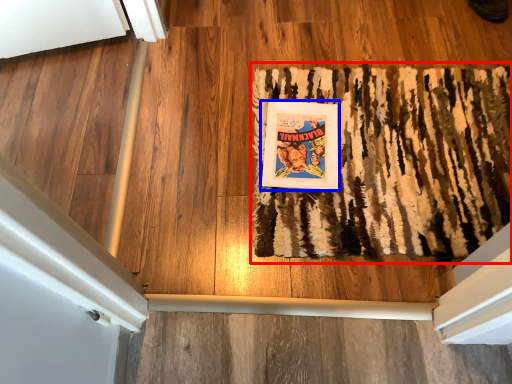
Question: Which object appears farthest to the camera in this image, mat (highlighted by a red box) or paperback book (highlighted by a blue box)?

Choices:
 (A) mat
 (B) paperback book

Answer: (B)